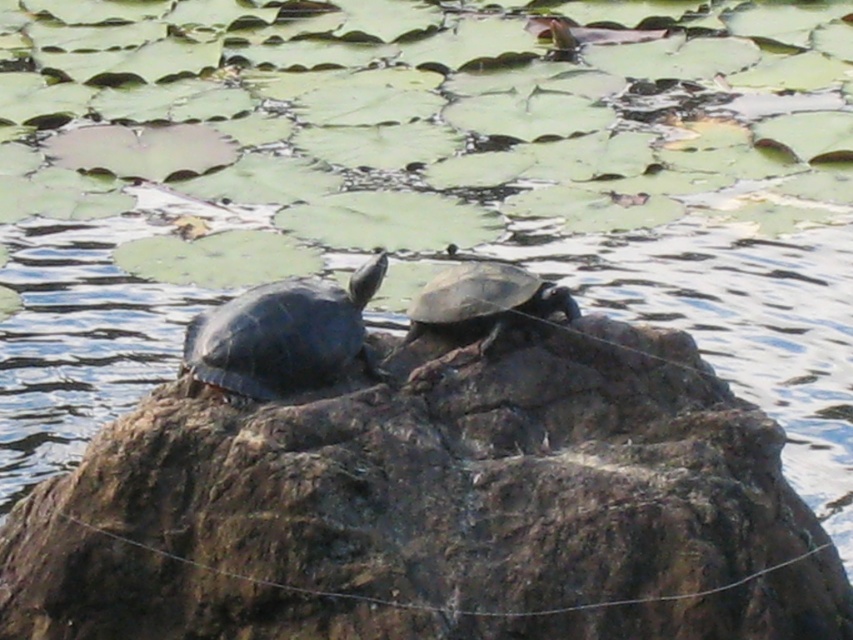
Does shiny black tortoise at center have a lesser height compared to shiny brown tortoise at center?

No, shiny black tortoise at center is not shorter than shiny brown tortoise at center.

Does shiny black tortoise at center have a larger size compared to shiny brown tortoise at center?

Yes.

Between point (215, 332) and point (451, 273), which one is positioned in front?

Positioned in front is point (215, 332).

The width and height of the screenshot is (853, 640). I want to click on shiny black tortoise at center, so click(x=283, y=336).

Which is more to the right, brown rough rock at center or shiny black tortoise at center?

From the viewer's perspective, brown rough rock at center appears more on the right side.

Can you confirm if brown rough rock at center is positioned to the left of shiny black tortoise at center?

No, brown rough rock at center is not to the left of shiny black tortoise at center.

Measure the distance between brown rough rock at center and camera.

brown rough rock at center and camera are 8.15 feet apart.

The width and height of the screenshot is (853, 640). I want to click on brown rough rock at center, so click(434, 508).

Who is more distant from viewer, (x=560, y=403) or (x=451, y=282)?

The point (x=451, y=282) is behind.

Describe the element at coordinates (434, 508) in the screenshot. The width and height of the screenshot is (853, 640). I see `brown rough rock at center` at that location.

Is point (467, 483) closer to viewer compared to point (509, 285)?

Yes.

Where is `brown rough rock at center`? brown rough rock at center is located at coordinates (434, 508).